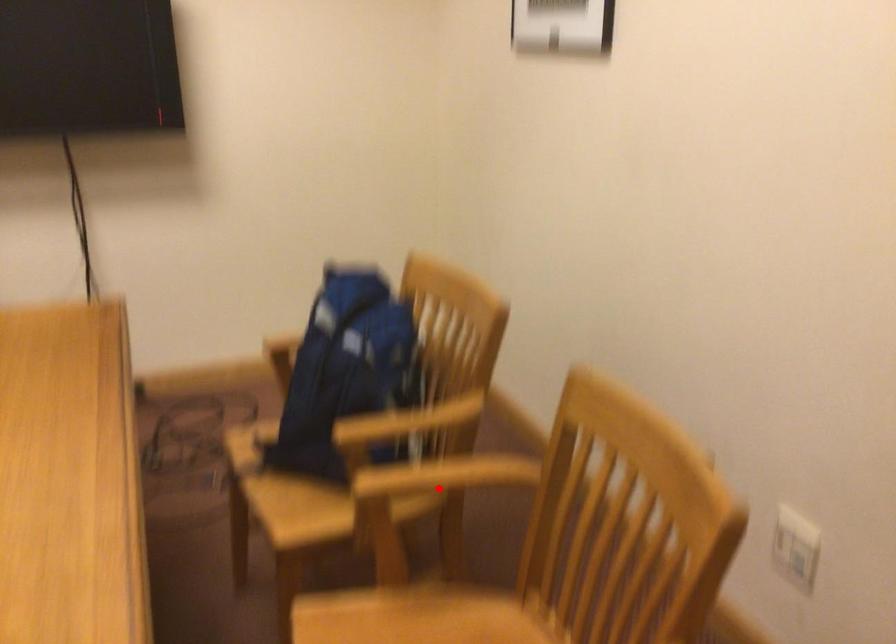
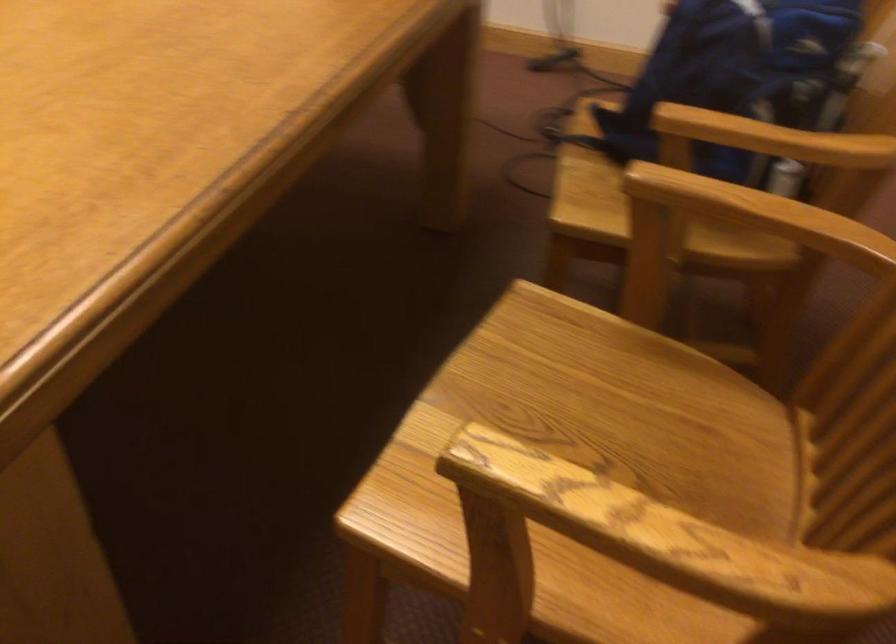
Where in the second image is the point corresponding to the highlighted location from the first image?

(743, 223)